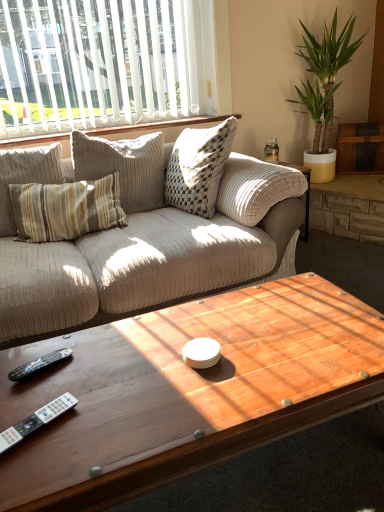
Identify the location of free space above wooden coffee table at center (from a real-world perspective). Image resolution: width=384 pixels, height=512 pixels. (157, 364).